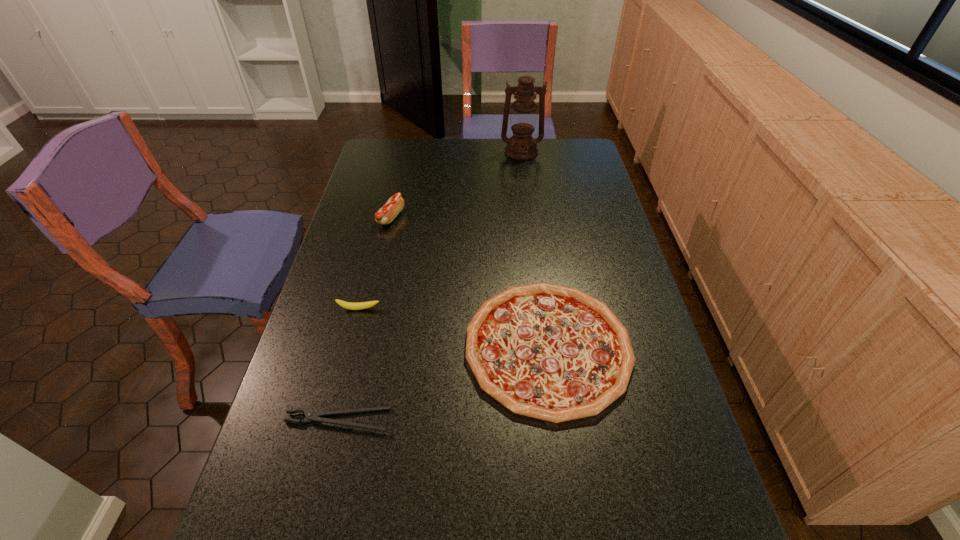
Where is `object that is the second nearest to the shortest object`? object that is the second nearest to the shortest object is located at coordinates (347, 305).

I want to click on object that is the nearest to the second tallest object, so click(x=347, y=305).

Where is `vacant space that satisfies the following two spatial constraints: 1. on the upward curve of the banana; 2. on the left side of the fourth tallest object`? The image size is (960, 540). vacant space that satisfies the following two spatial constraints: 1. on the upward curve of the banana; 2. on the left side of the fourth tallest object is located at coordinates [x=349, y=347].

This screenshot has width=960, height=540. What are the coordinates of `vacant position in the image that satisfies the following two spatial constraints: 1. on the upward curve of the fourth tallest object; 2. on the left side of the third tallest object` in the screenshot? It's located at (349, 347).

Locate an element on the screen. free space that satisfies the following two spatial constraints: 1. on the back side of the second farthest object; 2. on the left side of the tallest object is located at coordinates (406, 152).